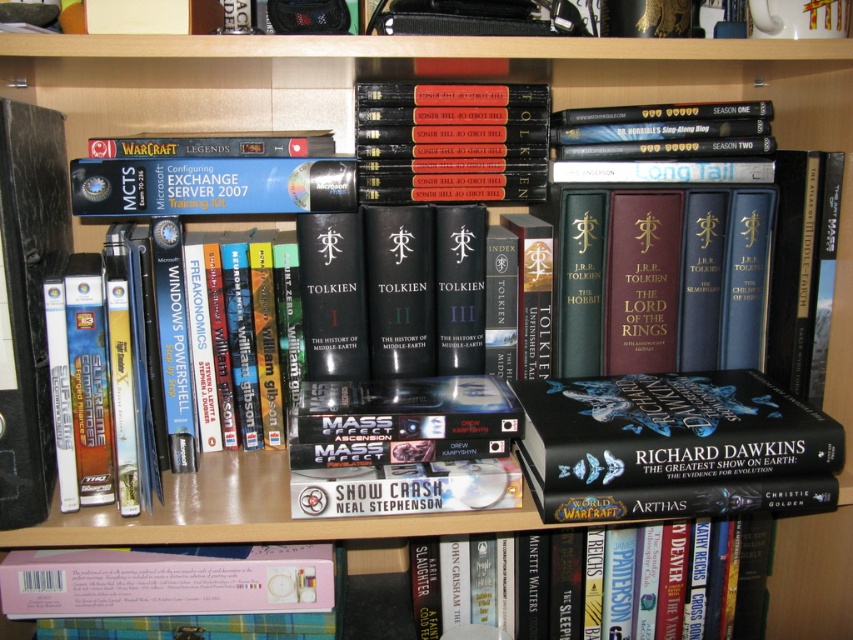
You are standing in front of a bookshelf filled with books and DVDs. You notice two points marked on the shelf at coordinates point (207, 552) and point (663, 602). Which point is closer to you?

Point (207, 552) is closer to you because it is in front of point (663, 602).

You are organizing a bookshelf and need to place both the pink matte book at lower left and the hardcover book at center. If you want to arrange them side by side without overlapping, which book should you place on the left to ensure they both fit?

The pink matte book at lower left should be placed on the left since its width is larger than the hardcover book at center, allowing both to fit side by side without overlapping.

You are standing in front of the bookshelf and want to reach both the pink matte book at lower left and the hardcover book at center. Which book should you grab first to avoid stretching too far?

You should grab the pink matte book at lower left first because it is closer to you than the hardcover book at center, so it requires less stretching.